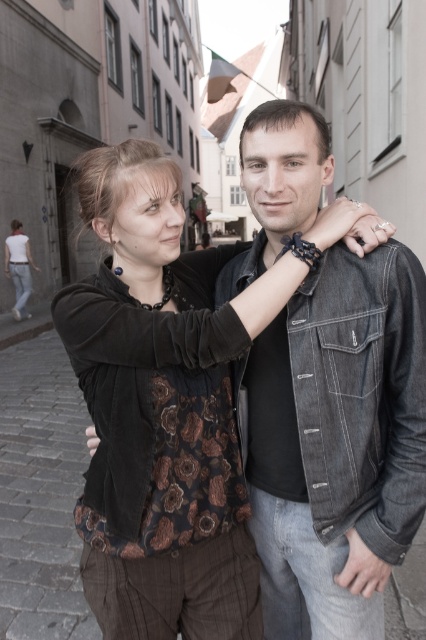
What do you see at coordinates (337, 442) in the screenshot? Image resolution: width=426 pixels, height=640 pixels. I see `denim jacket at center` at bounding box center [337, 442].

Who is more forward, (296, 563) or (23, 289)?

Positioned in front is point (296, 563).

Is point (270, 220) positioned behind point (39, 269)?

No.

Where is `denim jacket at center`? The height and width of the screenshot is (640, 426). denim jacket at center is located at coordinates (337, 442).

Is matte black jacket at center wider than denim jacket at center?

Indeed, matte black jacket at center has a greater width compared to denim jacket at center.

Describe the element at coordinates (166, 403) in the screenshot. The width and height of the screenshot is (426, 640). I see `matte black jacket at center` at that location.

In order to click on matte black jacket at center in this screenshot , I will do `click(166, 403)`.

Where is `matte black jacket at center`? The image size is (426, 640). matte black jacket at center is located at coordinates (166, 403).

Who is positioned more to the right, matte black jacket at center or matte black jacket at lower left?

From the viewer's perspective, matte black jacket at center appears more on the right side.

Who is higher up, matte black jacket at center or matte black jacket at lower left?

matte black jacket at lower left is higher up.

Describe the element at coordinates (166, 403) in the screenshot. This screenshot has width=426, height=640. I see `matte black jacket at center` at that location.

Where is `matte black jacket at center`? The image size is (426, 640). matte black jacket at center is located at coordinates (166, 403).